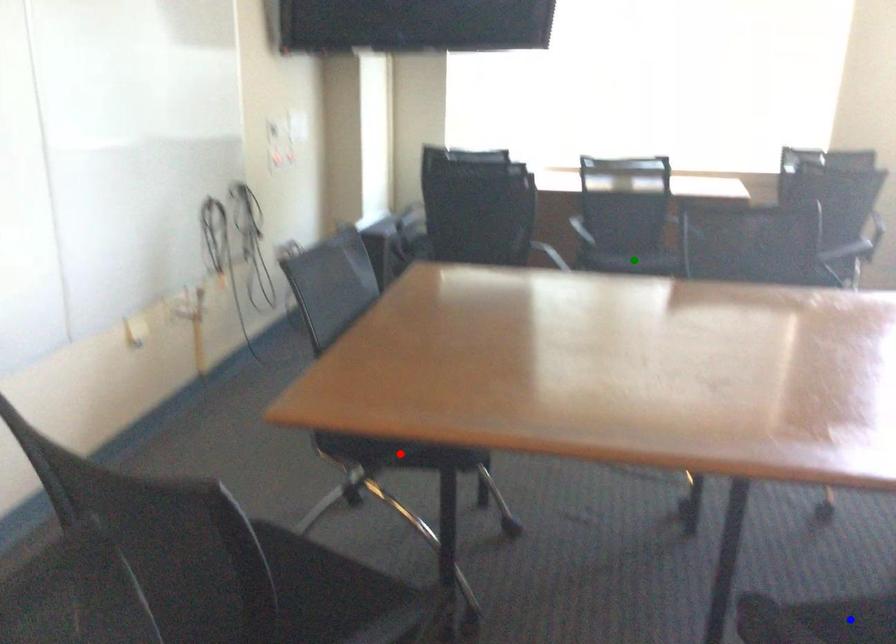
Order these from farthest to nearest:
red point | blue point | green point

green point → red point → blue point